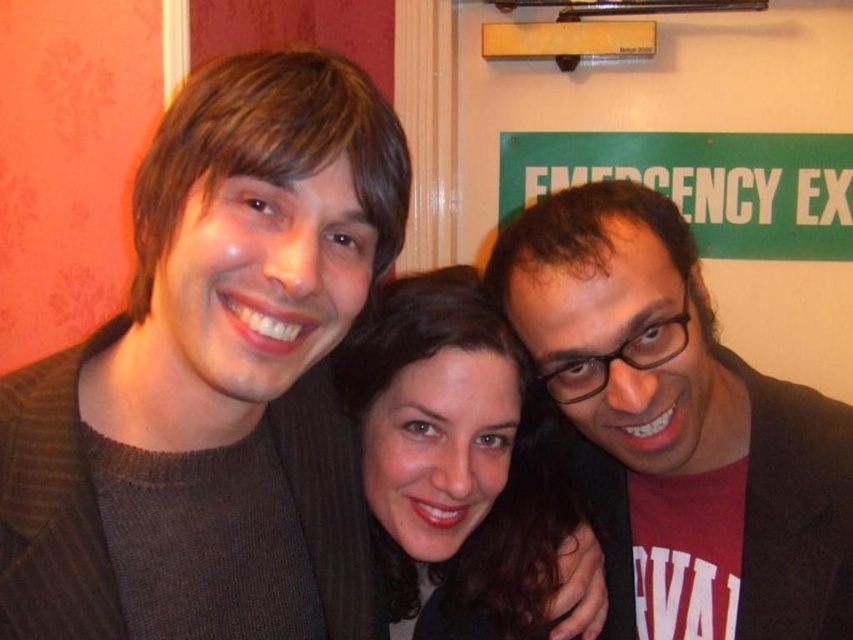
Question: Observing the image, what is the correct spatial positioning of brown knitted sweater at left in reference to black matte glasses at right?

Choices:
 (A) left
 (B) right

Answer: (A)

Question: Can you confirm if brown knitted sweater at left is positioned to the right of black matte glasses at right?

Choices:
 (A) yes
 (B) no

Answer: (B)

Question: Estimate the real-world distances between objects in this image. Which object is farther from the black matte glasses at right?

Choices:
 (A) matte black hair at center
 (B) brown knitted sweater at left

Answer: (B)

Question: Which of the following is the farthest from the observer?

Choices:
 (A) (630, 611)
 (B) (547, 589)

Answer: (A)

Question: From the image, what is the correct spatial relationship of black matte glasses at right in relation to matte black hair at center?

Choices:
 (A) below
 (B) above

Answer: (B)

Question: Based on their relative distances, which object is farther from the brown knitted sweater at left?

Choices:
 (A) black matte glasses at right
 (B) matte black hair at center

Answer: (A)